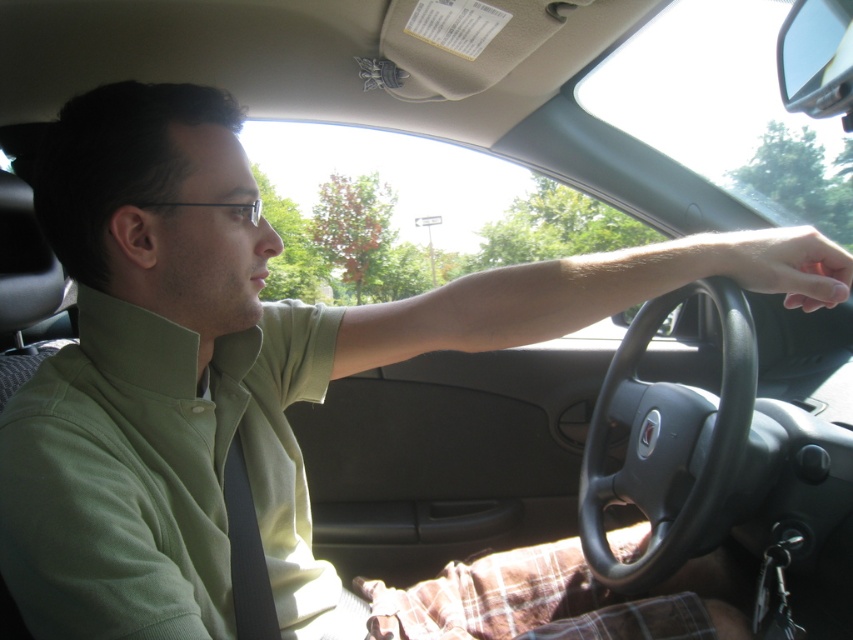
You are a passenger in a car and want to know if the green fabric shirt at center is taller than the black leather steering wheel at center. Can you confirm this based on the scene?

The green fabric shirt at center has a greater height compared to the black leather steering wheel at center, so yes, the green fabric shirt at center is taller than the black leather steering wheel at center.

You are a passenger in a car and want to adjust the sunroof. The car has a black leather steering wheel at center and a dry matte skin at steering wheel. Which object is bigger?

The black leather steering wheel at center is larger than the dry matte skin at steering wheel, so the steering wheel is bigger.

You are sitting in the passenger seat of the car and notice two points marked in the image. Which point, point (114, 355) or point (816, 272), is closer to you?

Point (114, 355) is closer to the viewer than point (816, 272).